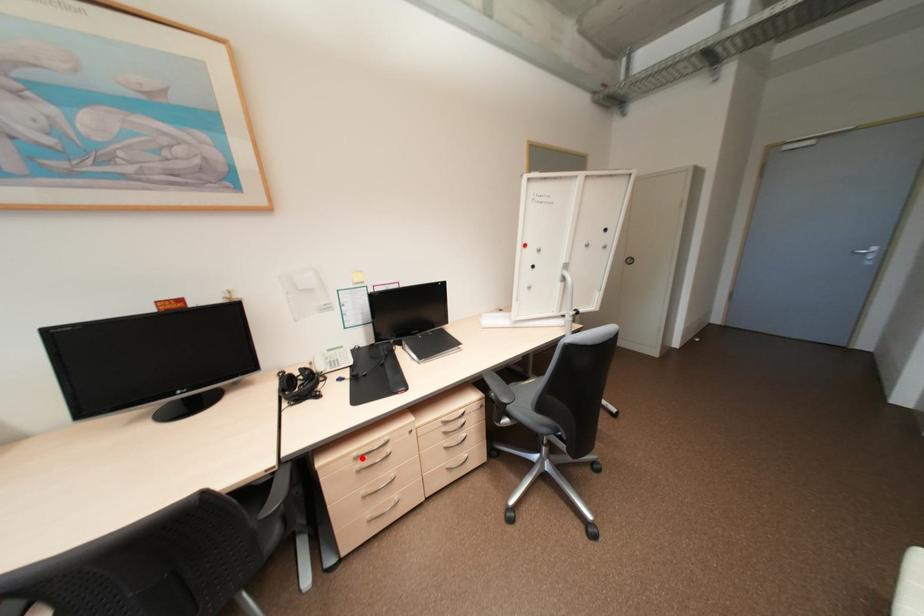
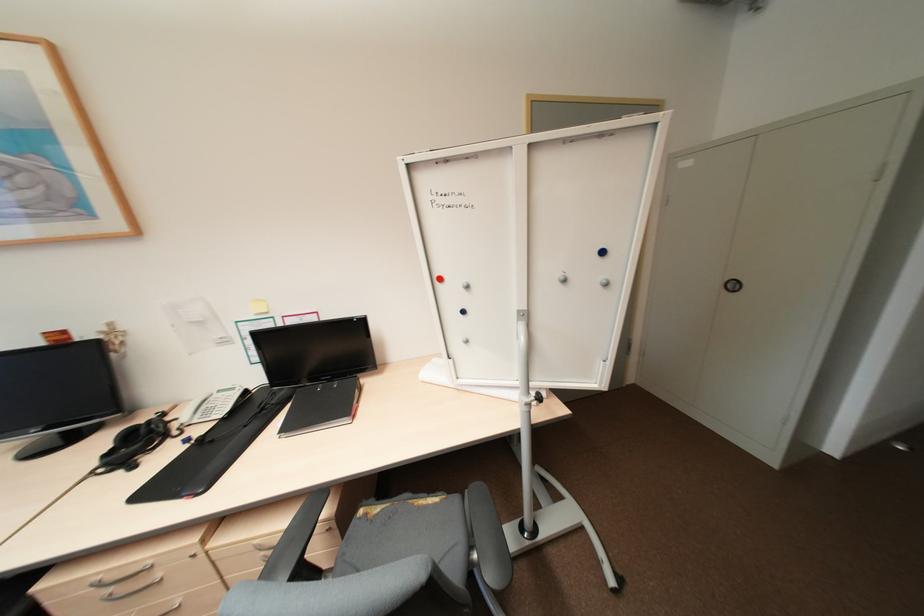
Find the pixel in the second image that matches the highlighted location in the first image.

(104, 584)